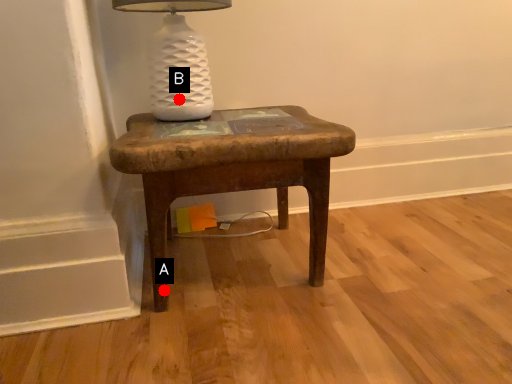
Question: Two points are circled on the image, labeled by A and B beside each circle. Which point is closer to the camera?

Choices:
 (A) A is closer
 (B) B is closer

Answer: (A)